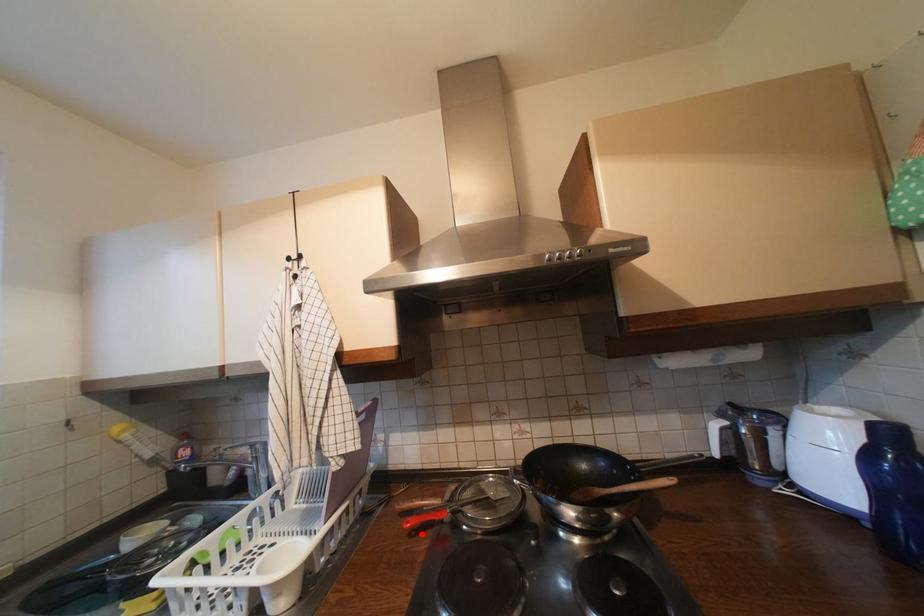
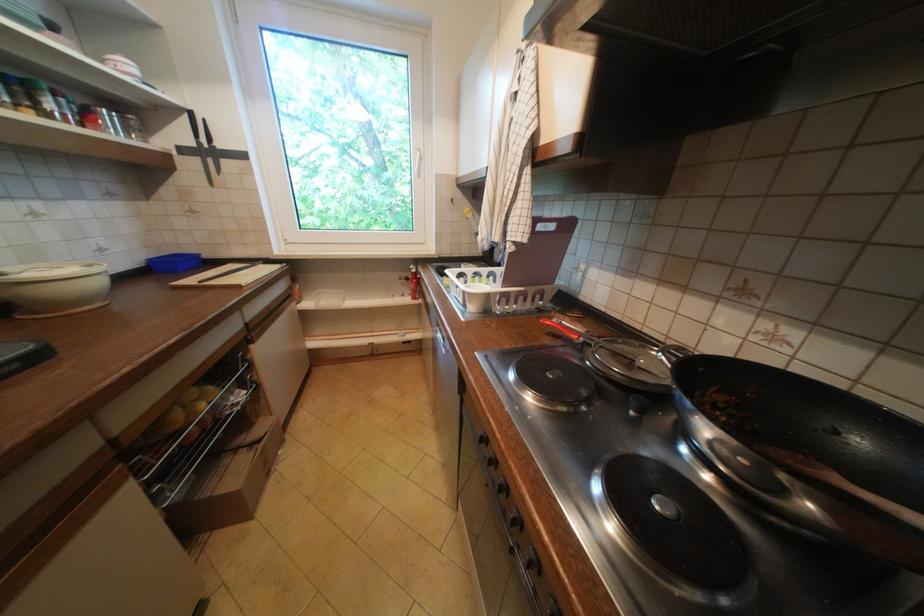
Locate, in the second image, the point that corresponds to the highlighted location in the first image.

(558, 334)